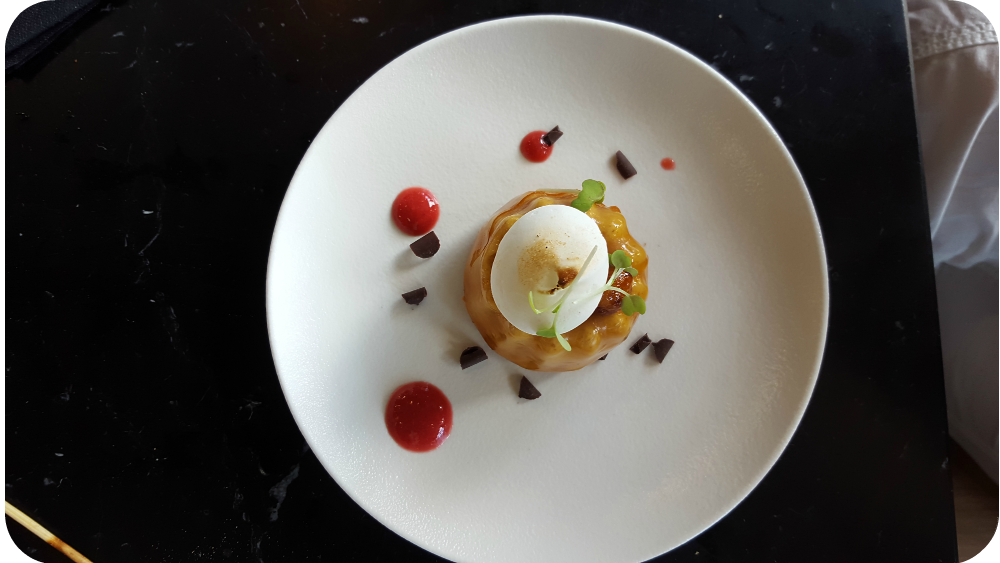
Locate an element on the screen. The height and width of the screenshot is (563, 1000). space to left of plate is located at coordinates (139, 274).